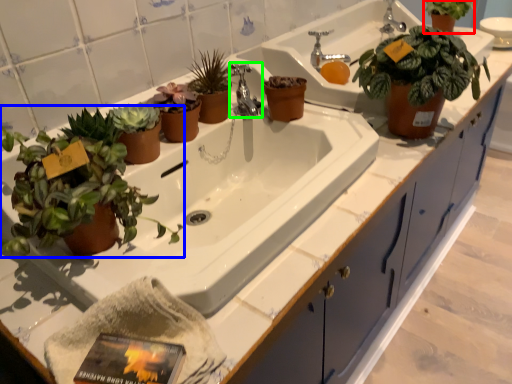
Question: Which object is the closest to the houseplant (highlighted by a red box)? Choose among these: houseplant (highlighted by a blue box) or tap (highlighted by a green box).

Choices:
 (A) houseplant
 (B) tap

Answer: (B)